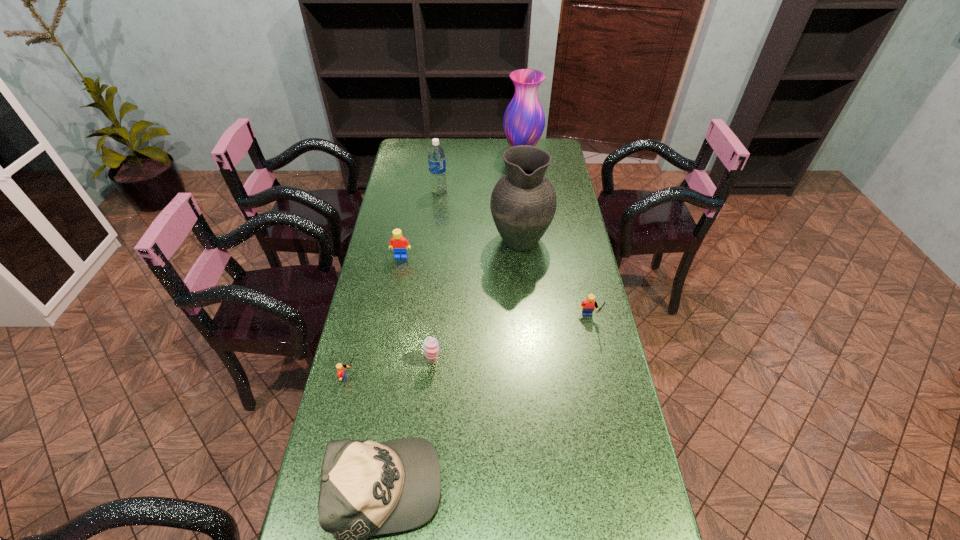
Find the location of a particular element. This screenshot has width=960, height=540. empty space between the sherbert and the second Lego from right to left is located at coordinates (418, 309).

This screenshot has height=540, width=960. Find the location of `vacant region between the right yellow Lego and the second Lego from right to left`. vacant region between the right yellow Lego and the second Lego from right to left is located at coordinates (494, 288).

Find the location of a particular element. free space between the red Lego and the nearer yellow Lego is located at coordinates (375, 317).

Find the location of `empty space that is in between the farthest Lego and the sherbert`. empty space that is in between the farthest Lego and the sherbert is located at coordinates (418, 309).

You are a GUI agent. You are given a task and a screenshot of the screen. Output one action in this format:
    pyautogui.click(x=<x>, y=<y>)
    Task: Click on the free space between the seventh farthest object and the sherbert
    The width and height of the screenshot is (960, 540).
    Given the screenshot: What is the action you would take?
    pyautogui.click(x=392, y=370)

At what (x,y) coordinates should I click in order to perform the action: click on vacant area that lies between the sixth shortest object and the sherbert. Please return your answer as a coordinate pair (x, y). The height and width of the screenshot is (540, 960). Looking at the image, I should click on (436, 276).

I want to click on object identified as the seventh closest to the baseball cap, so click(524, 121).

At what (x,y) coordinates should I click in order to perform the action: click on object that is the third closest to the nearest object. Please return your answer as a coordinate pair (x, y). Looking at the image, I should click on (588, 305).

Locate which Lego is the closest to the third tallest object. Please provide its 2D coordinates. Your answer should be formatted as a tuple, i.e. [(x, y)], where the tuple contains the x and y coordinates of a point satisfying the conditions above.

[(398, 243)]

You are a GUI agent. You are given a task and a screenshot of the screen. Output one action in this format:
    pyautogui.click(x=<x>, y=<y>)
    Task: Click on the Lego that is the third closest one to the seventh nearest object
    This screenshot has width=960, height=540.
    Given the screenshot: What is the action you would take?
    pyautogui.click(x=341, y=374)